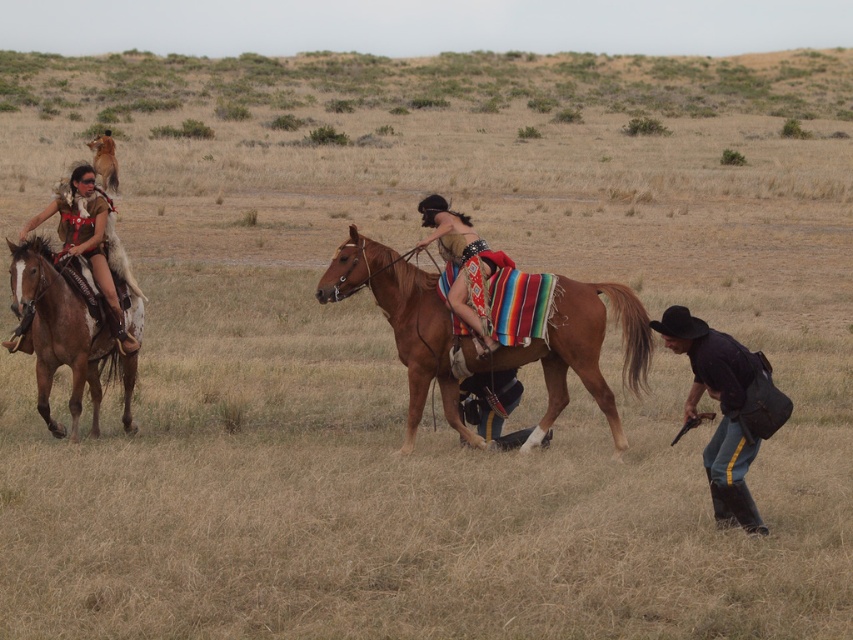
You are a photographer setting up a tripod in this scene. You need to ensure that both the brown leather horse at left and the black leather cowboy hat at lower right are visible in your shot. Given their sizes, which object will appear larger in the photo?

The brown leather horse at left will appear larger in the photo because it is taller than the black leather cowboy hat at lower right.

You are a photographer trying to capture a closeup shot of the brown leather horse at center and the leather vest at center. Your camera can focus on objects within a 25 inch range. Can you capture both subjects in focus without moving the camera?

The brown leather horse at center is 27.16 inches away from the leather vest at center. Since the camera can only focus within a 25 inch range, the distance between them exceeds the focus range. Therefore, you cannot capture both subjects in focus without moving the camera.